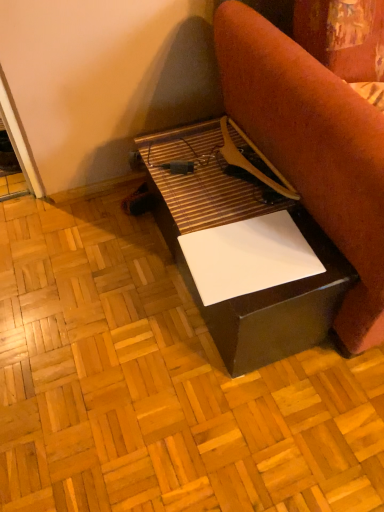
Where is `vacant space situated above white glossy plywood at center (from a real-world perspective)`? Image resolution: width=384 pixels, height=512 pixels. vacant space situated above white glossy plywood at center (from a real-world perspective) is located at coordinates (125, 333).